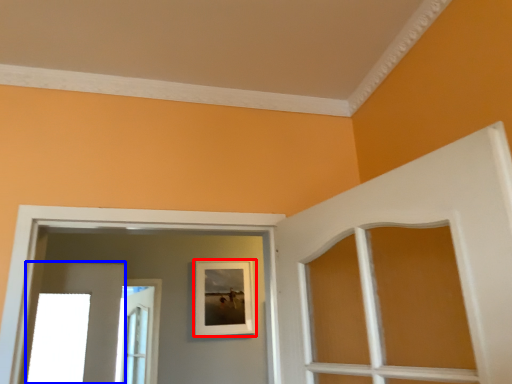
Question: Which object is closer to the camera taking this photo, picture frame (highlighted by a red box) or door (highlighted by a blue box)?

Choices:
 (A) picture frame
 (B) door

Answer: (A)